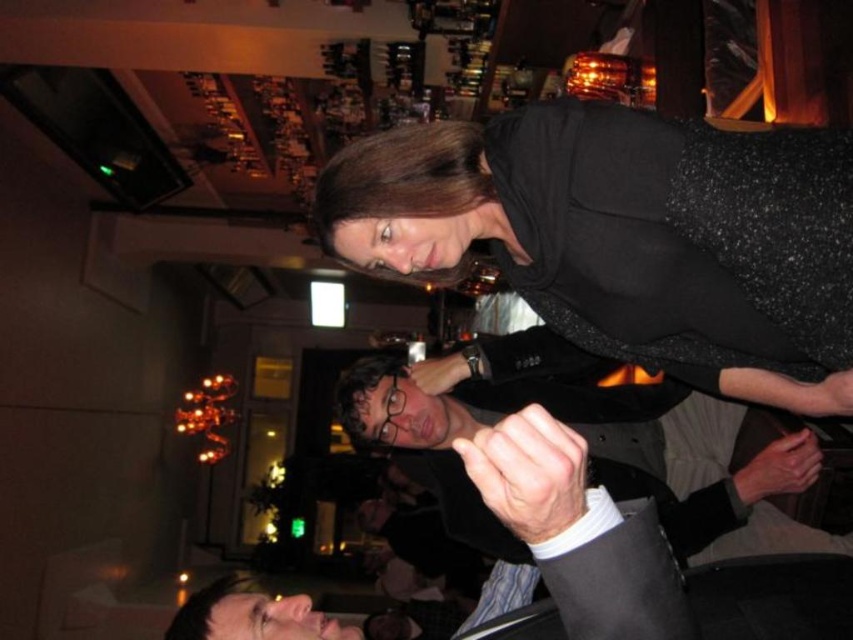
Question: From the image, what is the correct spatial relationship of black sequined dress at upper right in relation to matte black suit at center?

Choices:
 (A) left
 (B) right

Answer: (A)

Question: Can you confirm if black sequined dress at upper right is positioned below matte black suit at center?

Choices:
 (A) no
 (B) yes

Answer: (A)

Question: Which point is farther to the camera?

Choices:
 (A) (689, 321)
 (B) (682, 440)

Answer: (B)

Question: Which of the following is the farthest from the observer?

Choices:
 (A) matte black suit at center
 (B) black sequined dress at upper right

Answer: (A)

Question: Does black sequined dress at upper right appear under matte black suit at center?

Choices:
 (A) yes
 (B) no

Answer: (B)